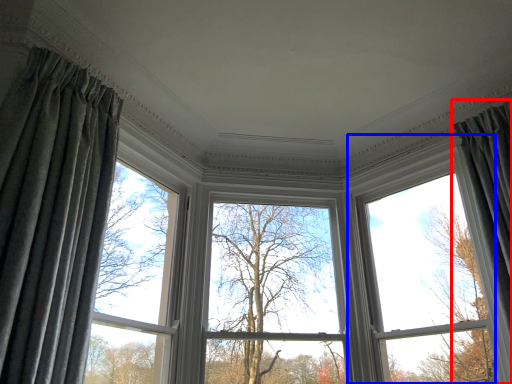
Question: Which object appears closest to the camera in this image, curtain (highlighted by a red box) or bay window (highlighted by a blue box)?

Choices:
 (A) curtain
 (B) bay window

Answer: (A)